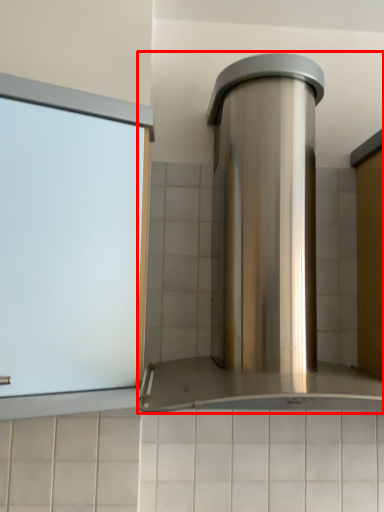
Question: From the image's perspective, what is the correct spatial relationship of home appliance (annotated by the red box) in relation to window?

Choices:
 (A) below
 (B) above

Answer: (B)